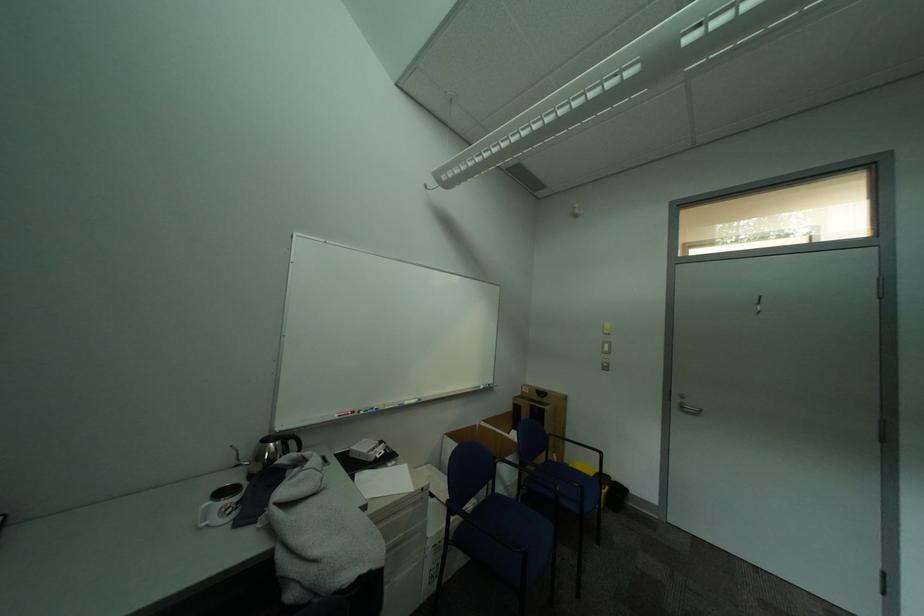
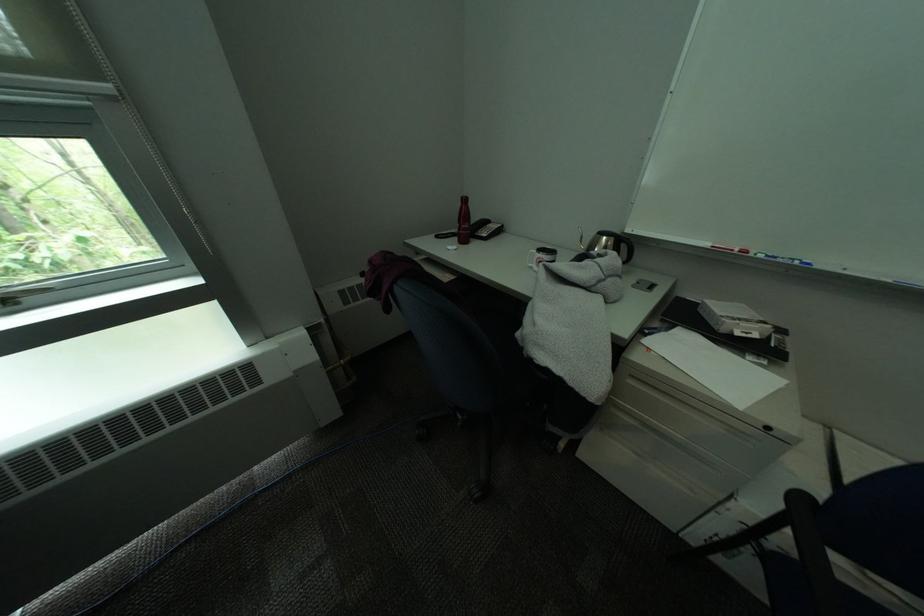
Locate, in the second image, the point that corresponds to [380,411] in the first image.

(791, 262)